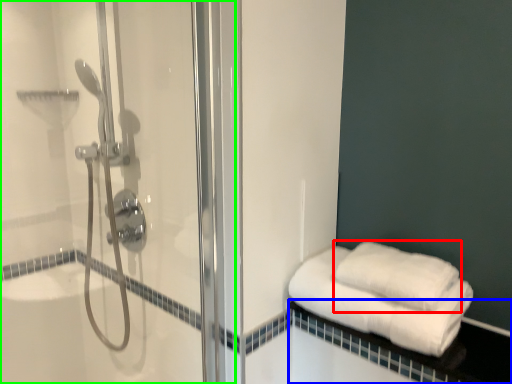
Question: Which object is the closest to the towel (highlighted by a red box)? Choose among these: balustrade (highlighted by a blue box) or shower door (highlighted by a green box).

Choices:
 (A) balustrade
 (B) shower door

Answer: (A)